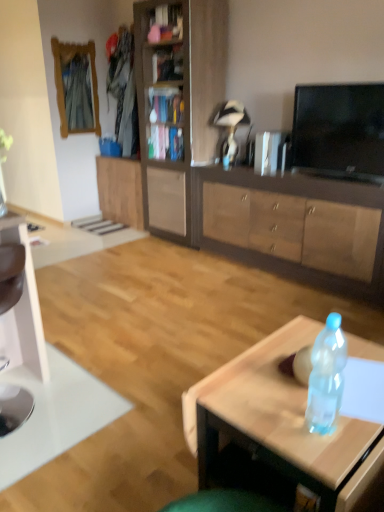
Question: From the image's perspective, would you say wooden bookshelf at upper center is shown under white glossy computer desk at left?

Choices:
 (A) yes
 (B) no

Answer: (B)

Question: Is wooden bookshelf at upper center next to white glossy computer desk at left?

Choices:
 (A) no
 (B) yes

Answer: (A)

Question: Is white glossy computer desk at left completely or partially inside wooden bookshelf at upper center?

Choices:
 (A) no
 (B) yes

Answer: (A)

Question: Does wooden bookshelf at upper center come behind white glossy computer desk at left?

Choices:
 (A) yes
 (B) no

Answer: (A)

Question: From the image's perspective, is wooden bookshelf at upper center on white glossy computer desk at left?

Choices:
 (A) yes
 (B) no

Answer: (A)

Question: Considering the positions of wooden bookshelf at upper center and brown wood cabinet at center, positioned as the first cabinetry in right-to-left order, in the image, is wooden bookshelf at upper center taller or shorter than brown wood cabinet at center, positioned as the first cabinetry in right-to-left order,?

Choices:
 (A) short
 (B) tall

Answer: (A)

Question: Considering the positions of point click(155, 24) and point click(228, 206), is point click(155, 24) closer or farther from the camera than point click(228, 206)?

Choices:
 (A) closer
 (B) farther

Answer: (B)

Question: From the image's perspective, is wooden bookshelf at upper center positioned above or below brown wood cabinet at center, positioned as the 3th cabinetry in left-to-right order?

Choices:
 (A) above
 (B) below

Answer: (A)

Question: Looking at the image, does wooden bookshelf at upper center seem bigger or smaller compared to brown wood cabinet at center, positioned as the first cabinetry in right-to-left order?

Choices:
 (A) small
 (B) big

Answer: (A)

Question: From a real-world perspective, relative to metallic silver tv at upper right, is wooden cabinet at center, which is the 2th cabinetry in right-to-left order, vertically above or below?

Choices:
 (A) below
 (B) above

Answer: (B)

Question: Considering the relative positions of wooden cabinet at center, which is counted as the second cabinetry, starting from the left, and metallic silver tv at upper right in the image provided, is wooden cabinet at center, which is counted as the second cabinetry, starting from the left, to the left or to the right of metallic silver tv at upper right?

Choices:
 (A) left
 (B) right

Answer: (A)

Question: In terms of size, does wooden cabinet at center, which is the 2th cabinetry in right-to-left order, appear bigger or smaller than metallic silver tv at upper right?

Choices:
 (A) small
 (B) big

Answer: (B)

Question: In terms of height, does wooden cabinet at center, which is the 2th cabinetry in right-to-left order, look taller or shorter compared to metallic silver tv at upper right?

Choices:
 (A) tall
 (B) short

Answer: (A)

Question: From the image's perspective, is wooden cabinet at center, which is the 2th cabinetry in right-to-left order, positioned above or below translucent plastic bottle at center?

Choices:
 (A) above
 (B) below

Answer: (A)

Question: Based on their sizes in the image, would you say wooden cabinet at center, which is counted as the second cabinetry, starting from the left, is bigger or smaller than translucent plastic bottle at center?

Choices:
 (A) big
 (B) small

Answer: (A)